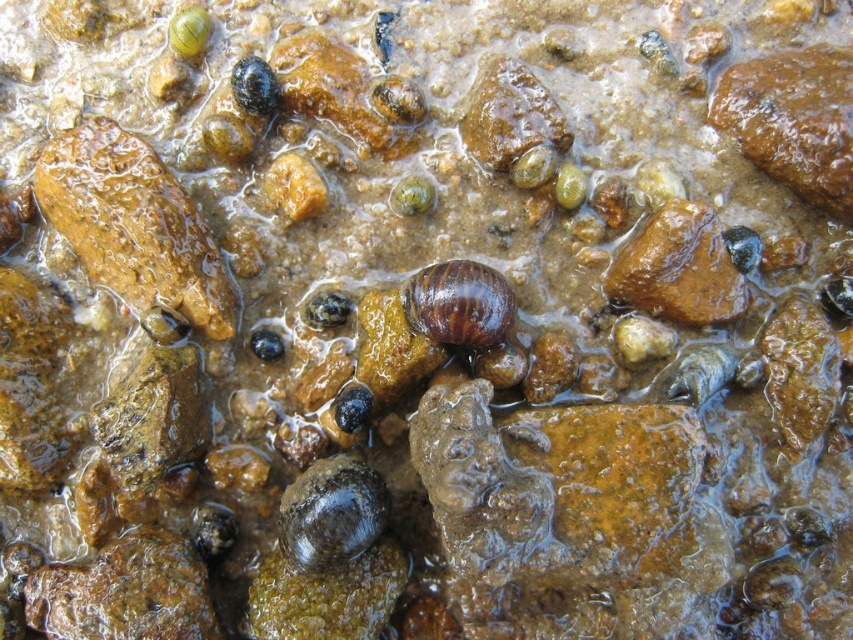
Does shiny dark brown snail at center-left have a lesser width compared to shiny brown snail at center?

No.

Does shiny dark brown snail at center-left have a larger size compared to shiny brown snail at center?

Yes, shiny dark brown snail at center-left is bigger than shiny brown snail at center.

Locate an element on the screen. The image size is (853, 640). shiny dark brown snail at center-left is located at coordinates (331, 513).